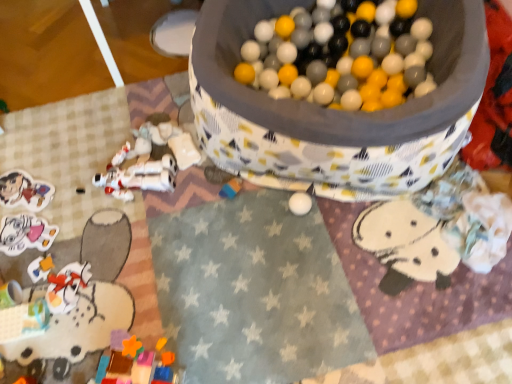
The image size is (512, 384). In order to click on vacant position to the left of white plastic astronaut at lower left, placed as the 4th toy when sorted from left to right in this screenshot , I will do `click(69, 182)`.